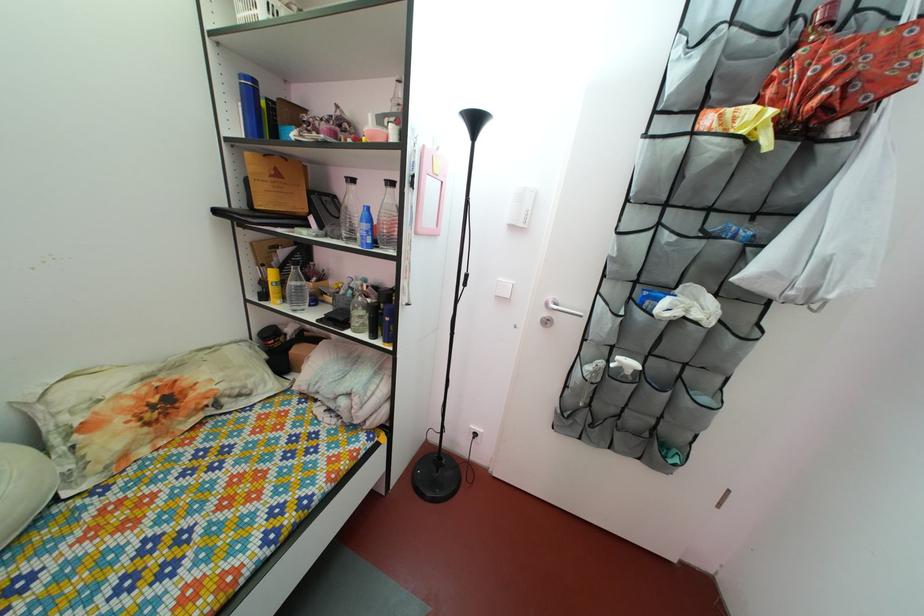
Find where to lift the blue plastic bottle. Please return your answer as a coordinate pair (x, y).

(366, 228)